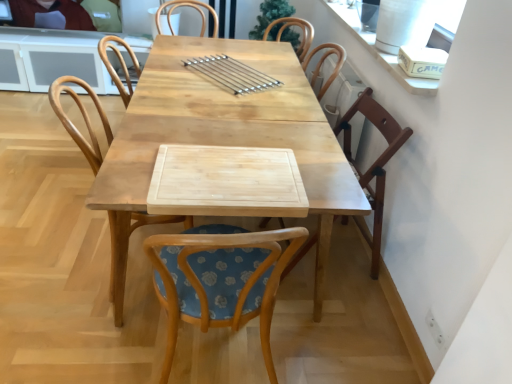
Question: From a real-world perspective, relative to matte black laptop at upper left, is wooden chair at center, which is counted as the first chair, starting from the left, vertically above or below?

Choices:
 (A) below
 (B) above

Answer: (A)

Question: From the image's perspective, is wooden chair at center, which is counted as the first chair, starting from the left, positioned above or below matte black laptop at upper left?

Choices:
 (A) above
 (B) below

Answer: (B)

Question: Which of these objects is positioned closest to the natural wood table at center?

Choices:
 (A) woodenchair at center, which is the 2th chair in left-to-right order
 (B) wooden chair at right, which ranks as the 1th chair in right-to-left order
 (C) wooden chair at center, which is the third chair from right to left
 (D) matte black laptop at upper left
 (E) satin silver skewers at center

Answer: (E)

Question: Considering the real-world distances, which object is farthest from the woodenchair at center, which is counted as the 2th chair, starting from the right?

Choices:
 (A) wooden chair at center, which is counted as the first chair, starting from the left
 (B) natural wood table at center
 (C) matte black laptop at upper left
 (D) satin silver skewers at center
 (E) wooden chair at right, which ranks as the 1th chair in right-to-left order

Answer: (C)